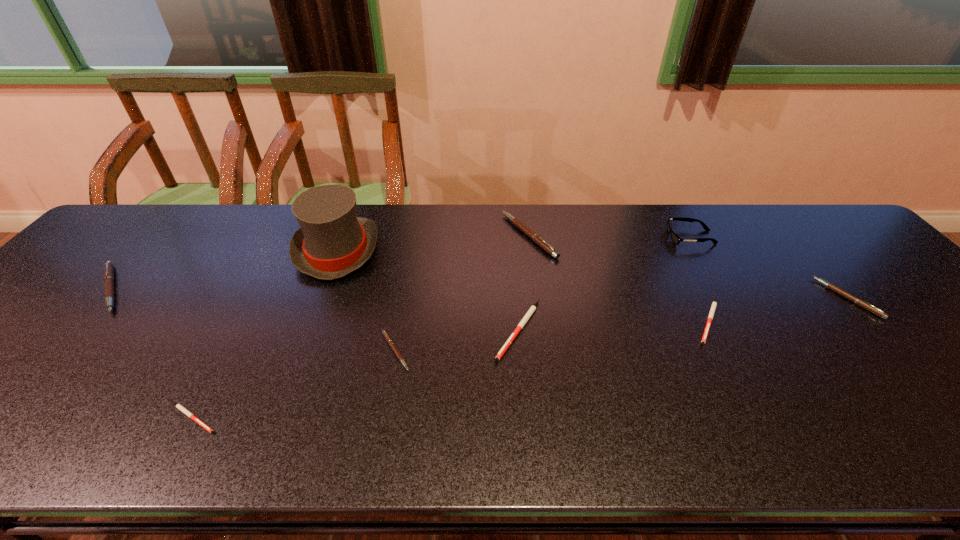
This screenshot has height=540, width=960. In order to click on vacant space at the left edge of the desktop in this screenshot , I will do `click(48, 314)`.

You are a GUI agent. You are given a task and a screenshot of the screen. Output one action in this format:
    pyautogui.click(x=<x>, y=<y>)
    Task: Click on the vacant space at the right edge of the desktop
    
    Given the screenshot: What is the action you would take?
    pyautogui.click(x=878, y=306)

Where is `vacant space at the far right corner of the desktop`? The image size is (960, 540). vacant space at the far right corner of the desktop is located at coordinates (805, 242).

In order to click on free spot between the leftmost object and the dress hat in this screenshot , I will do `click(225, 269)`.

Identify the location of vacant area that lies between the dress hat and the nearest white pen. The width and height of the screenshot is (960, 540). (265, 334).

Identify the location of free space between the tallest object and the second pen from right to left. (523, 286).

The height and width of the screenshot is (540, 960). Identify the location of empty space between the black sunglasses and the nearest pink pen. (542, 294).

The height and width of the screenshot is (540, 960). In order to click on empty space that is in between the gray dress hat and the rightmost pink pen in this screenshot , I will do `click(592, 274)`.

The width and height of the screenshot is (960, 540). Find the location of `unoccupied position between the third biggest pink pen and the sixth shortest object`. unoccupied position between the third biggest pink pen and the sixth shortest object is located at coordinates (479, 293).

Where is `free space that is in between the shortest pen and the smallest pink pen`? free space that is in between the shortest pen and the smallest pink pen is located at coordinates (294, 385).